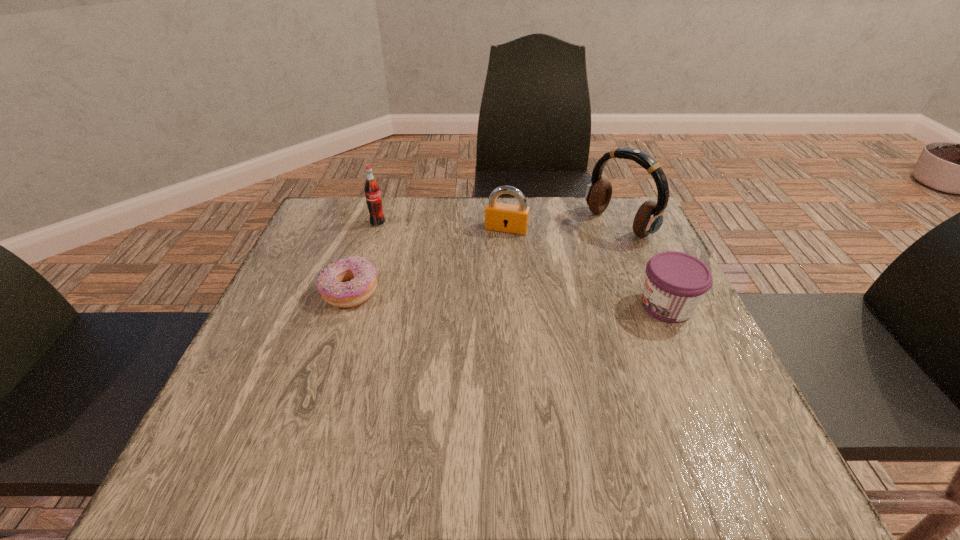
In order to click on vacant spot on the desktop that is between the shortest object and the second shortest object and is positioned on the label of the soda bottle in this screenshot , I will do `click(495, 298)`.

The width and height of the screenshot is (960, 540). Find the location of `free space on the desktop that is between the shortest object and the jam and is positioned to unlock the third tallest object from the front`. free space on the desktop that is between the shortest object and the jam and is positioned to unlock the third tallest object from the front is located at coordinates (481, 298).

At what (x,y) coordinates should I click in order to perform the action: click on vacant spot on the desktop that is between the shortest object and the fourth tallest object and is positioned on the ear cup of the tallest object. Please return your answer as a coordinate pair (x, y). Looking at the image, I should click on (494, 298).